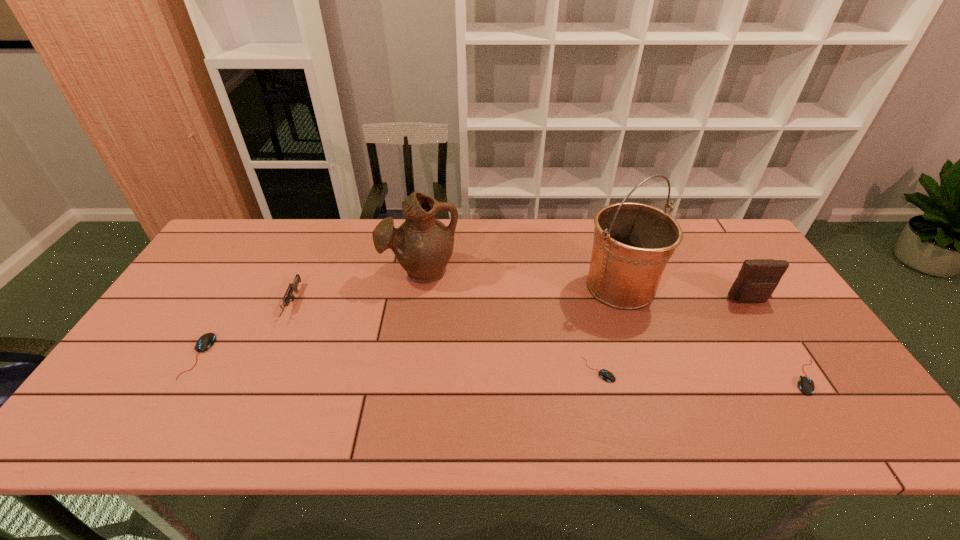
The width and height of the screenshot is (960, 540). I want to click on bucket situated at the far edge, so click(x=633, y=242).

At what (x,y) coordinates should I click in order to perform the action: click on object that is positioned at the left edge. Please return your answer as a coordinate pair (x, y). The image size is (960, 540). Looking at the image, I should click on (207, 340).

I want to click on mouse at the right edge, so 806,385.

Where is `pouch positioned at the right edge`? pouch positioned at the right edge is located at coordinates (758, 278).

Find the location of a particular element. Image resolution: width=960 pixels, height=540 pixels. object that is at the near left corner is located at coordinates (207, 340).

Find the location of a particular element. The width and height of the screenshot is (960, 540). object positioned at the near right corner is located at coordinates click(x=806, y=385).

The width and height of the screenshot is (960, 540). Find the location of `blank area at the far edge`. blank area at the far edge is located at coordinates (463, 239).

Identify the location of vacant space at the near edge. (760, 400).

Image resolution: width=960 pixels, height=540 pixels. Find the location of `vacant space at the left edge`. vacant space at the left edge is located at coordinates (173, 308).

Identify the location of vacant space at the far left corner of the desktop. This screenshot has height=540, width=960. pos(244,251).